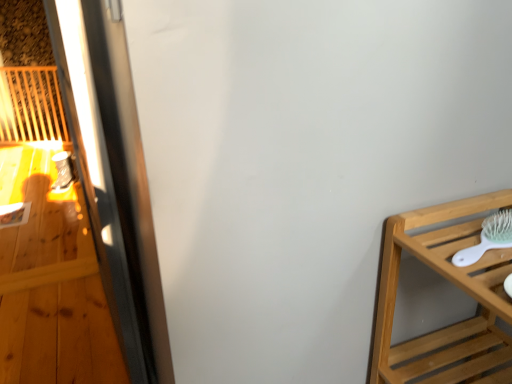
Where is `free point behind white plastic brush at right`? The image size is (512, 384). free point behind white plastic brush at right is located at coordinates (468, 213).